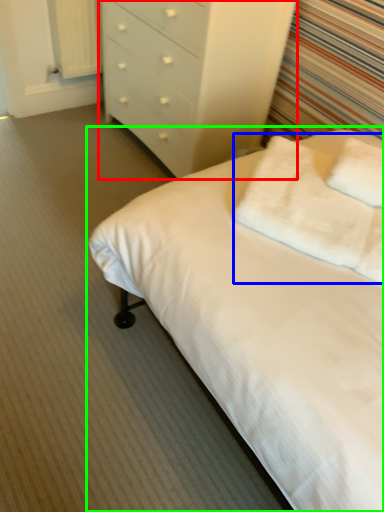
Question: Which is farther away from chest of drawers (highlighted by a red box)? pillow (highlighted by a blue box) or bed (highlighted by a green box)?

Choices:
 (A) pillow
 (B) bed

Answer: (B)